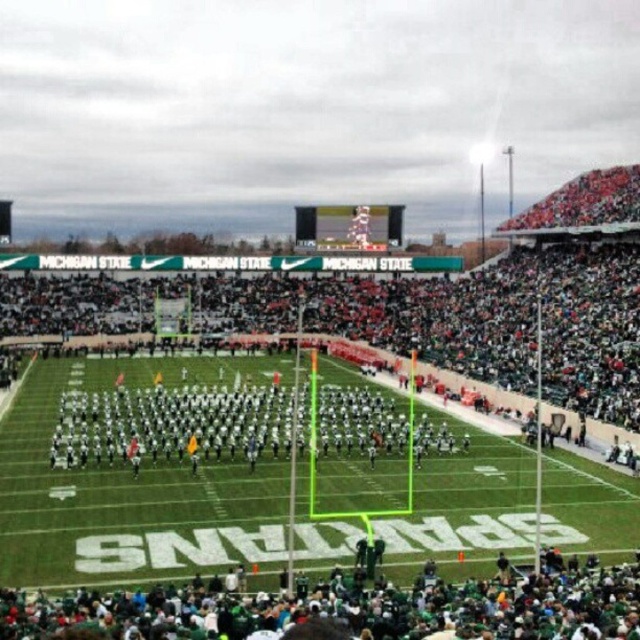
You are a photographer standing at the edge of the field. You want to take a photo that includes both the green fabric crowd at lower center and the white uniformed players at center. Which object should you focus on first to ensure both are in clear view?

The green fabric crowd at lower center is closer to the viewer than the white uniformed players at center, so you should focus on the green fabric crowd at lower center first to ensure both are in clear view.

You are standing at the point labeled as point (352, 605) in the football stadium image. What is the nearest object to you?

The nearest object to you is the green fabric crowd at lower center because the point (352, 605) is located on it.

You are a photographer standing at the camera position. You want to capture a photo of the green fabric crowd at lower center. The stadium rules state that you must maintain a minimum distance of 40 meters from the crowd to avoid disruption. Is your current position compliant with the rules?

The green fabric crowd at lower center and camera are 40.01 meters apart from each other. Since 40.01 meters is just over the required 40 meters minimum distance, your current position is compliant with the stadium rules.